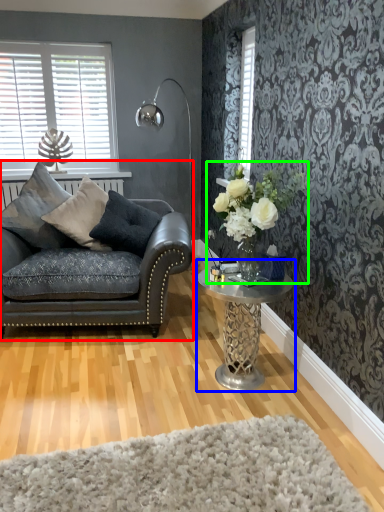
Question: Which object is the closest to the studio couch (highlighted by a red box)? Choose among these: coffee table (highlighted by a blue box) or floral arrangement (highlighted by a green box).

Choices:
 (A) coffee table
 (B) floral arrangement

Answer: (A)